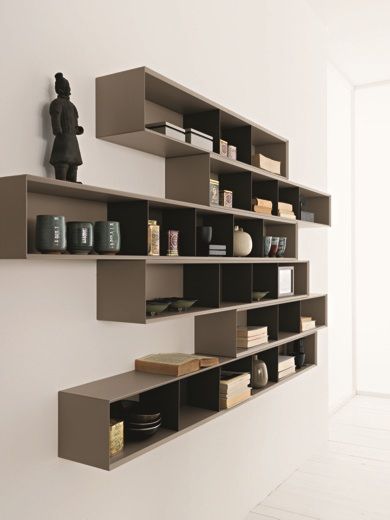
Image resolution: width=390 pixels, height=520 pixels. I want to click on stack of books, so click(290, 367), click(264, 206), click(291, 209), click(260, 338), click(242, 388), click(217, 248).